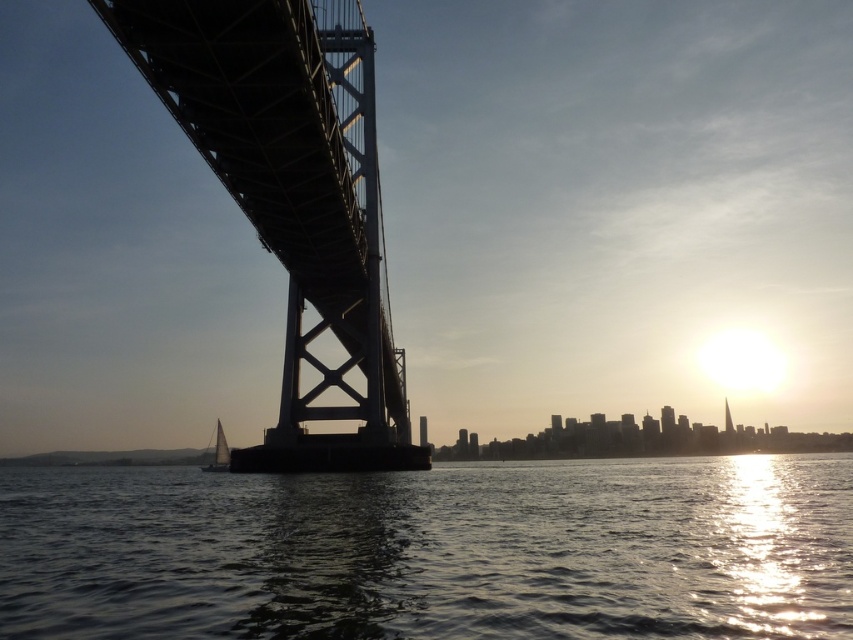
Question: Does shiny dark water at center have a larger size compared to white sailboat at lower left?

Choices:
 (A) no
 (B) yes

Answer: (B)

Question: Observing the image, what is the correct spatial positioning of shiny dark water at center in reference to silhouette steel bridge at left?

Choices:
 (A) left
 (B) right

Answer: (B)

Question: Among these points, which one is farthest from the camera?

Choices:
 (A) (142, 61)
 (B) (683, 634)

Answer: (A)

Question: Can you confirm if silhouette steel bridge at left is smaller than white sailboat at lower left?

Choices:
 (A) no
 (B) yes

Answer: (B)

Question: Which object appears closest to the camera in this image?

Choices:
 (A) white sailboat at lower left
 (B) shiny dark water at center

Answer: (B)

Question: Which of the following is the farthest from the observer?

Choices:
 (A) (454, 548)
 (B) (263, 97)
 (C) (216, 426)

Answer: (C)